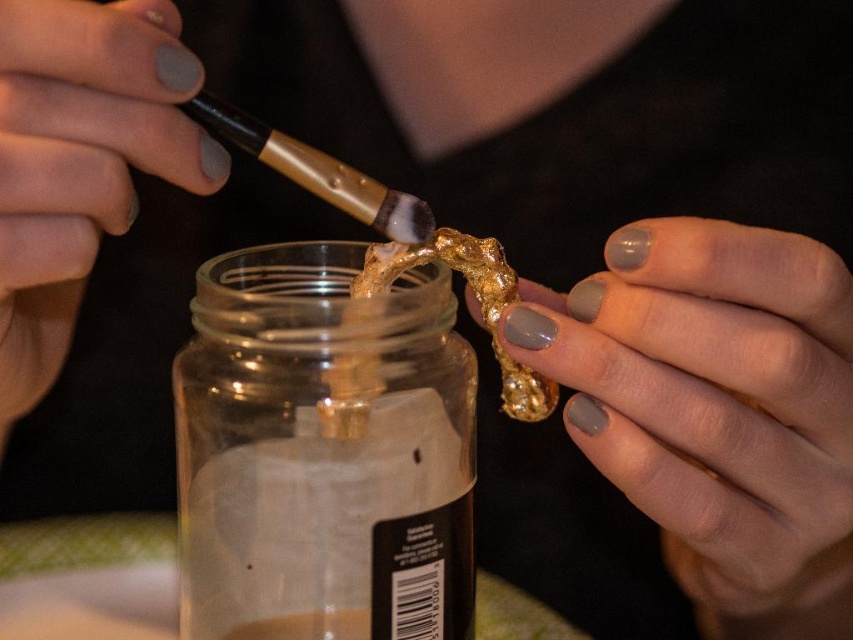
Does matte gray nail polish at upper right appear on the left side of gold leaf at center?

In fact, matte gray nail polish at upper right is to the right of gold leaf at center.

In the scene shown: Which is below, matte gray nail polish at upper right or gold leaf at center?

matte gray nail polish at upper right

Who is more forward, (x=723, y=273) or (x=538, y=417)?

Point (x=723, y=273) is in front.

The image size is (853, 640). Find the location of `matte gray nail polish at upper right`. matte gray nail polish at upper right is located at coordinates (715, 406).

Can you confirm if transparent glass jar at center is thinner than matte gray nail polish at upper left?

Yes.

Describe the element at coordinates (323, 451) in the screenshot. I see `transparent glass jar at center` at that location.

Who is more forward, (340,524) or (103,160)?

Point (103,160) is more forward.

The image size is (853, 640). I want to click on transparent glass jar at center, so click(323, 451).

Which is more to the left, transparent glass jar at center or matte gray nail polish at upper right?

From the viewer's perspective, transparent glass jar at center appears more on the left side.

Find the location of a particular element. This screenshot has width=853, height=640. transparent glass jar at center is located at coordinates (323, 451).